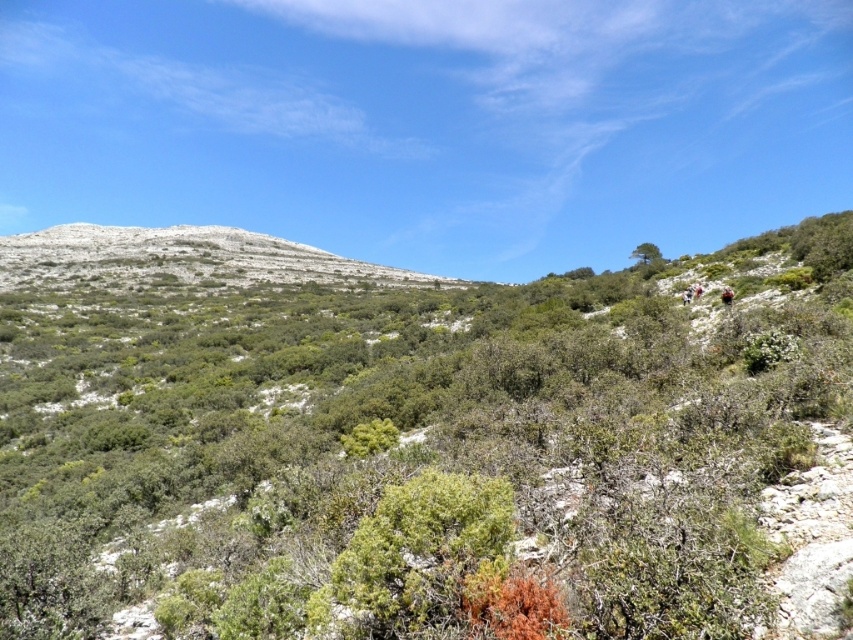
You are planning a hiking route and need to know which area takes up more space in the image to estimate the terrain difficulty. Which occupies more space in the image, the green shrubs at center or the white rocky mountain at upper left?

The white rocky mountain at upper left occupies more space than the green shrubs at center according to the description.

You are standing at the base of the mountain and want to reach the point marked at point (166, 595). Given that your average walking speed is 1.5 meters per second, how long will it take you to reach that point?

The distance between you and point (166, 595) is 14.46 meters. At a walking speed of 1.5 meters per second, it will take approximately 9.64 seconds to reach the point.